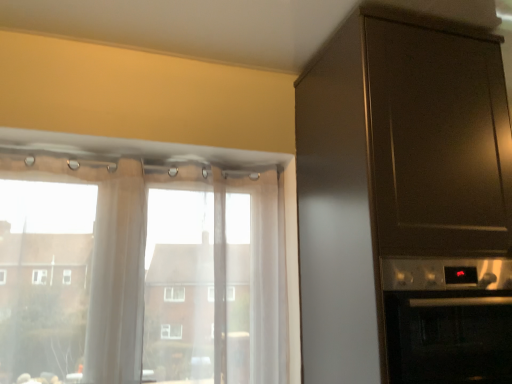
Identify the location of metallic dark brown cabinet at right. Image resolution: width=512 pixels, height=384 pixels. (405, 204).

What do you see at coordinates (405, 204) in the screenshot? This screenshot has width=512, height=384. I see `metallic dark brown cabinet at right` at bounding box center [405, 204].

Where is `sheer white curtain at left`? sheer white curtain at left is located at coordinates [x=108, y=261].

Can you tell me how much metallic dark brown cabinet at right and translucent fabric at left differ in facing direction?

They differ by 1.22 degrees in their facing directions.

Would you say translucent fabric at left is part of metallic dark brown cabinet at right's contents?

Definitely not — translucent fabric at left is not inside metallic dark brown cabinet at right.

Which object is closer to the camera, metallic dark brown cabinet at right or translucent fabric at left?

metallic dark brown cabinet at right is closer to the camera.

From a real-world perspective, is metallic dark brown cabinet at right physically located above or below translucent fabric at left?

From a real-world perspective, metallic dark brown cabinet at right is physically above translucent fabric at left.

Is the depth of metallic dark brown cabinet at right less than that of sheer white curtain at left?

Yes.

Does metallic dark brown cabinet at right touch sheer white curtain at left?

No, metallic dark brown cabinet at right is not making contact with sheer white curtain at left.

Is metallic dark brown cabinet at right at the left side of sheer white curtain at left?

Incorrect, metallic dark brown cabinet at right is not on the left side of sheer white curtain at left.

Considering the sizes of objects satin silver oven at right and metallic dark brown cabinet at right in the image provided, who is shorter, satin silver oven at right or metallic dark brown cabinet at right?

Standing shorter between the two is satin silver oven at right.

Is satin silver oven at right in front of or behind metallic dark brown cabinet at right in the image?

satin silver oven at right is behind metallic dark brown cabinet at right.

Is satin silver oven at right placed right next to metallic dark brown cabinet at right?

No, satin silver oven at right is not with metallic dark brown cabinet at right.

The width and height of the screenshot is (512, 384). Find the location of `window above the satin silver oven at right (from a real-world perspective)`. window above the satin silver oven at right (from a real-world perspective) is located at coordinates (147, 279).

Which of these two, translucent fabric at left or satin silver oven at right, is smaller?

Smaller between the two is translucent fabric at left.

Which of these two, translucent fabric at left or satin silver oven at right, stands taller?

Result: translucent fabric at left is taller.

Is translucent fabric at left at the left side of satin silver oven at right?

Yes.

From the image's perspective, relative to translucent fabric at left, is sheer white curtain at left above or below?

Clearly, from the image's perspective, sheer white curtain at left is above translucent fabric at left.

How many degrees apart are the facing directions of sheer white curtain at left and translucent fabric at left?

0.912 degrees.

In terms of height, does sheer white curtain at left look taller or shorter compared to translucent fabric at left?

sheer white curtain at left is shorter than translucent fabric at left.

Could you tell me if sheer white curtain at left is facing translucent fabric at left?

Yes, sheer white curtain at left faces towards translucent fabric at left.

Consider the image. How much distance is there between translucent fabric at left and sheer white curtain at left?

The distance of translucent fabric at left from sheer white curtain at left is 6.38 inches.

From the image's perspective, relative to sheer white curtain at left, is translucent fabric at left above or below?

Based on their image positions, translucent fabric at left is located beneath sheer white curtain at left.

The width and height of the screenshot is (512, 384). Find the location of `curtain lying on the left of translucent fabric at left`. curtain lying on the left of translucent fabric at left is located at coordinates (108, 261).

From a real-world perspective, relative to metallic dark brown cabinet at right, is translucent fabric at left vertically above or below?

translucent fabric at left is below metallic dark brown cabinet at right.

In the scene shown: Can you confirm if translucent fabric at left is bigger than metallic dark brown cabinet at right?

Actually, translucent fabric at left might be smaller than metallic dark brown cabinet at right.

Which object is more forward, translucent fabric at left or metallic dark brown cabinet at right?

metallic dark brown cabinet at right is more forward.

Identify the location of window on the left of metallic dark brown cabinet at right. pos(147,279).

Locate an element on the screen. This screenshot has width=512, height=384. cabinetry located on the right of sheer white curtain at left is located at coordinates (405, 204).

Looking at the image, which one is located closer to translucent fabric at left, metallic dark brown cabinet at right or sheer white curtain at left?

sheer white curtain at left is positioned closer to the anchor translucent fabric at left.

Which object lies further to the anchor point sheer white curtain at left, satin silver oven at right or translucent fabric at left?

satin silver oven at right lies further to sheer white curtain at left than the other object.

Looking at the image, which one is located further to translucent fabric at left, satin silver oven at right or metallic dark brown cabinet at right?

Based on the image, satin silver oven at right appears to be further to translucent fabric at left.

Considering their positions, is translucent fabric at left positioned further to metallic dark brown cabinet at right than sheer white curtain at left?

Among the two, sheer white curtain at left is located further to metallic dark brown cabinet at right.

When comparing their distances from satin silver oven at right, does translucent fabric at left or metallic dark brown cabinet at right seem closer?

Among the two, metallic dark brown cabinet at right is located nearer to satin silver oven at right.

Which object lies further to the anchor point translucent fabric at left, metallic dark brown cabinet at right or satin silver oven at right?

Based on the image, satin silver oven at right appears to be further to translucent fabric at left.

Estimate the real-world distances between objects in this image. Which object is closer to translucent fabric at left, sheer white curtain at left or satin silver oven at right?

sheer white curtain at left is closer to translucent fabric at left.

When comparing their distances from satin silver oven at right, does sheer white curtain at left or metallic dark brown cabinet at right seem further?

sheer white curtain at left is positioned further to the anchor satin silver oven at right.

Locate an element on the screen. The height and width of the screenshot is (384, 512). window situated between sheer white curtain at left and metallic dark brown cabinet at right from left to right is located at coordinates (147, 279).

Where is `cabinetry between sheer white curtain at left and satin silver oven at right`? This screenshot has height=384, width=512. cabinetry between sheer white curtain at left and satin silver oven at right is located at coordinates (405, 204).

This screenshot has height=384, width=512. What are the coordinates of `cabinetry between translucent fabric at left and satin silver oven at right from left to right` in the screenshot? It's located at (405, 204).

What are the coordinates of `window between sheer white curtain at left and satin silver oven at right in the horizontal direction` in the screenshot? It's located at (147, 279).